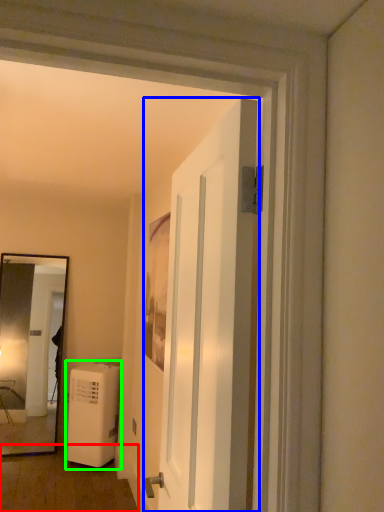
Question: Which object is the closest to the corridor (highlighted by a red box)? Choose among these: door (highlighted by a blue box) or air conditioner (highlighted by a green box).

Choices:
 (A) door
 (B) air conditioner

Answer: (B)